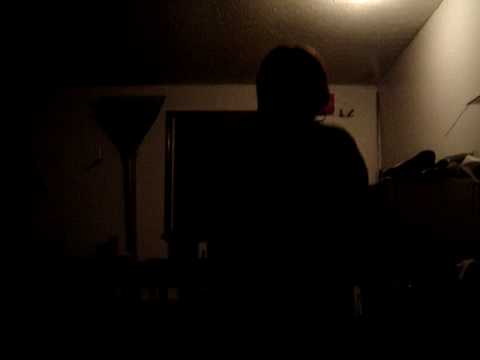
The width and height of the screenshot is (480, 360). What are the coordinates of `chair` in the screenshot? It's located at (166, 274).